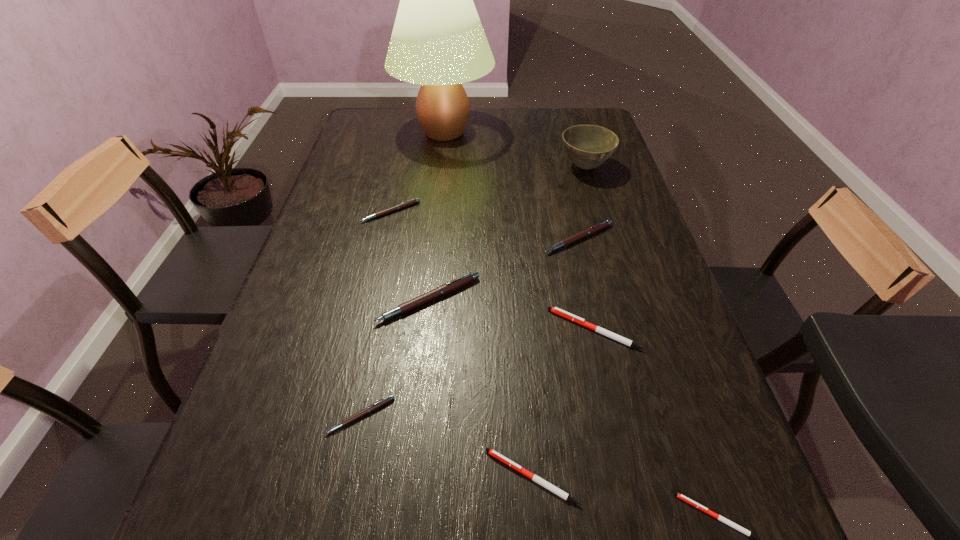
Where is `vacant space located at the nib of the smallest pink pen`? The image size is (960, 540). vacant space located at the nib of the smallest pink pen is located at coordinates (350, 469).

Locate an element on the screen. vacant area located 0.220m on the clicker of the second smallest white pen is located at coordinates (356, 477).

The width and height of the screenshot is (960, 540). Identify the location of free region located 0.240m on the clicker of the second smallest white pen. coord(345,477).

Locate an element on the screen. The width and height of the screenshot is (960, 540). free space located on the clicker of the second smallest white pen is located at coordinates (350, 477).

Identify the location of object present at the far edge. (438, 41).

Where is `lampshade located at the left edge`? This screenshot has height=540, width=960. lampshade located at the left edge is located at coordinates (438, 41).

The width and height of the screenshot is (960, 540). I want to click on pen at the left edge, so click(413, 201).

Identify the location of bowl that is at the right edge. (588, 146).

At what (x,y) coordinates should I click in order to perform the action: click on object located in the far left corner section of the desktop. Please return your answer as a coordinate pair (x, y). This screenshot has height=540, width=960. Looking at the image, I should click on (438, 41).

Where is `vacant region at the far edge of the desktop`? This screenshot has width=960, height=540. vacant region at the far edge of the desktop is located at coordinates (501, 108).